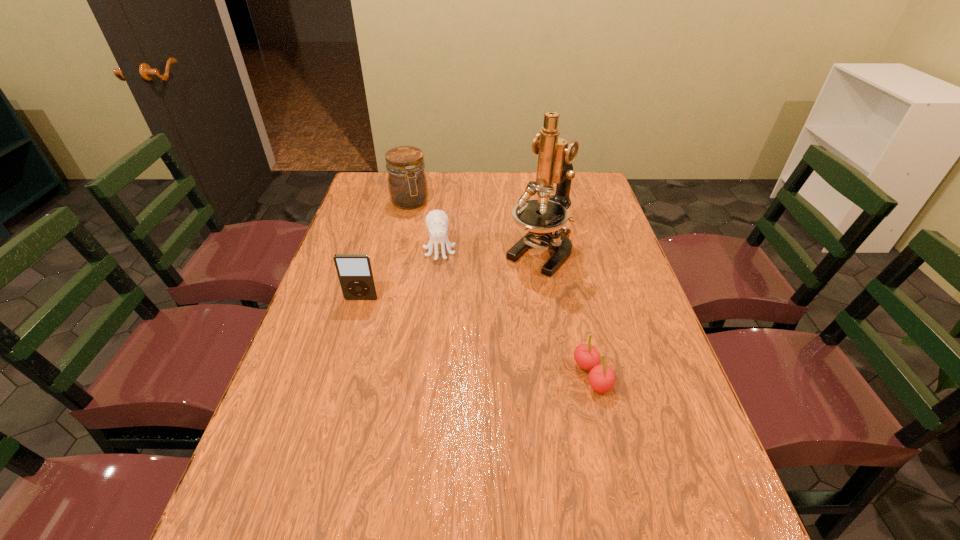
This screenshot has height=540, width=960. Find the location of `unoccupied area between the second shortest object and the shortest object`. unoccupied area between the second shortest object and the shortest object is located at coordinates (516, 313).

Find the location of `free space between the cherry and the tallest object`. free space between the cherry and the tallest object is located at coordinates pyautogui.click(x=566, y=314).

You are a GUI agent. You are given a task and a screenshot of the screen. Output one action in this format:
    pyautogui.click(x=<x>, y=<y>)
    Task: Click on the empty location between the second tallest object and the nearest object
    
    Given the screenshot: What is the action you would take?
    pyautogui.click(x=501, y=289)

Point out which object is positioned as the nearest to the farthest object. Please provide its 2D coordinates. Your answer should be formatted as a tuple, i.e. [(x, y)], where the tuple contains the x and y coordinates of a point satisfying the conditions above.

[(437, 221)]

Where is `the third closest object to the iPod`? The height and width of the screenshot is (540, 960). the third closest object to the iPod is located at coordinates (407, 183).

Where is `vacant space that satisfies the following two spatial constraints: 1. on the front-facing side of the fourth farthest object; 2. on the left side of the cherry`? vacant space that satisfies the following two spatial constraints: 1. on the front-facing side of the fourth farthest object; 2. on the left side of the cherry is located at coordinates (339, 376).

This screenshot has width=960, height=540. In order to click on vacant region that satisfies the following two spatial constraints: 1. on the front side of the microscope; 2. on the left side of the nearest object in this screenshot , I will do `click(562, 376)`.

You are a GUI agent. You are given a task and a screenshot of the screen. Output one action in this format:
    pyautogui.click(x=<x>, y=<y>)
    Task: Click on the free spot that satisfies the following two spatial constraints: 1. on the front side of the shortest object; 2. on the left side of the microscope
    This screenshot has height=540, width=960.
    Given the screenshot: What is the action you would take?
    pyautogui.click(x=562, y=376)

The height and width of the screenshot is (540, 960). In order to click on blank space that satisfies the following two spatial constraints: 1. on the front-facing side of the fourth farthest object; 2. on the left side of the nearest object in this screenshot , I will do `click(339, 376)`.